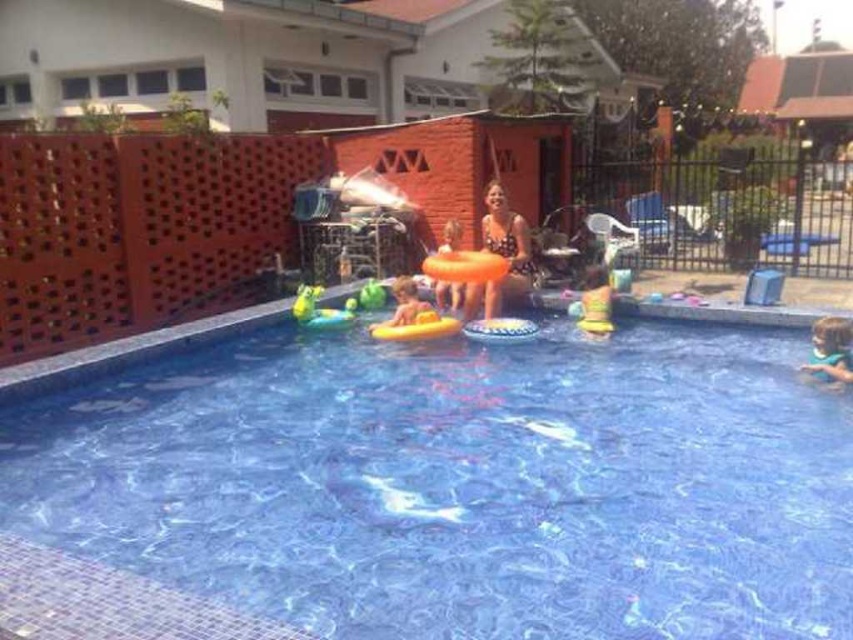
Between green rubber duck at center and yellow rubber ring at center, which one is positioned higher?

yellow rubber ring at center is higher up.

Does point (321, 291) lie behind point (402, 320)?

Yes, it is.

Locate an element on the screen. Image resolution: width=853 pixels, height=640 pixels. green rubber duck at center is located at coordinates (320, 308).

Find the location of a particular element. green rubber duck at center is located at coordinates (320, 308).

Does blue glossy water at center appear on the left side of swimsuit fabric woman at center?

Indeed, blue glossy water at center is positioned on the left side of swimsuit fabric woman at center.

In order to click on blue glossy water at center in this screenshot , I will do `click(461, 483)`.

Is point (477, 474) positioned behind point (503, 237)?

No.

Locate an element on the screen. The width and height of the screenshot is (853, 640). blue glossy water at center is located at coordinates (461, 483).

Does swimsuit fabric woman at center have a lesser height compared to yellow rubber ring at center?

No.

Is swimsuit fabric woman at center below yellow rubber ring at center?

Actually, swimsuit fabric woman at center is above yellow rubber ring at center.

Is point (502, 186) closer to camera compared to point (421, 310)?

No, it is not.

This screenshot has width=853, height=640. Identify the location of swimsuit fabric woman at center. (502, 257).